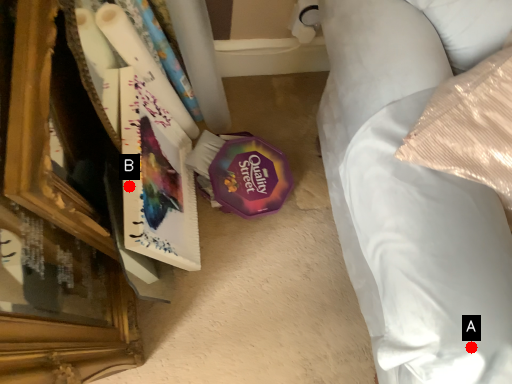
Question: Two points are circled on the image, labeled by A and B beside each circle. Which of the following is the farthest from the observer?

Choices:
 (A) A is further
 (B) B is further

Answer: (B)